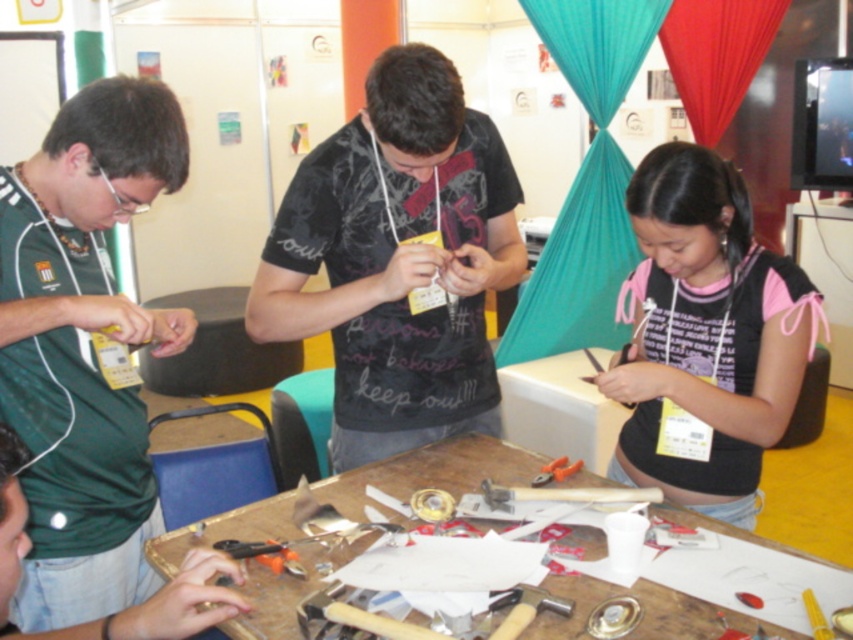
Question: Which is nearer to the wooden workbench at center?

Choices:
 (A) black matte shirt at center
 (B) orange plastic pliers at center
 (C) wooden hammer at center

Answer: (C)

Question: Considering the relative positions of pink fabric at center and orange plastic pliers at center in the image provided, where is pink fabric at center located with respect to orange plastic pliers at center?

Choices:
 (A) right
 (B) left

Answer: (A)

Question: Which of the following is the closest to the observer?

Choices:
 (A) black matte shirt at center
 (B) green matte shirt at left
 (C) wooden hammer at center
 (D) orange plastic pliers at center

Answer: (B)

Question: In this image, where is pink fabric at center located relative to orange plastic pliers at center?

Choices:
 (A) below
 (B) above

Answer: (B)

Question: Can you confirm if black matte shirt at center is thinner than pink fabric at center?

Choices:
 (A) yes
 (B) no

Answer: (B)

Question: Which point is closer to the camera?

Choices:
 (A) wooden workbench at center
 (B) wooden hammer at center
 (C) black matte shirt at center

Answer: (A)